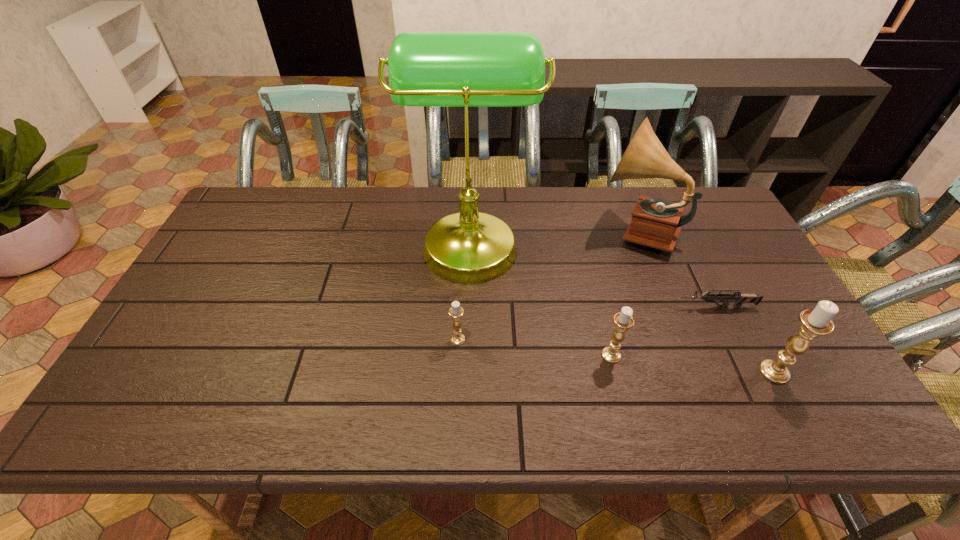
Point out which object is positioned as the third nearest to the tallest candle holder. Please provide its 2D coordinates. Your answer should be formatted as a tuple, i.e. [(x, y)], where the tuple contains the x and y coordinates of a point satisfying the conditions above.

[(656, 223)]

Select which candle holder appears as the closest to the phonograph record. Please provide its 2D coordinates. Your answer should be formatted as a tuple, i.e. [(x, y)], where the tuple contains the x and y coordinates of a point satisfying the conditions above.

[(623, 320)]

Identify the location of the closest candle holder to the rightmost candle holder. This screenshot has width=960, height=540. (623, 320).

The width and height of the screenshot is (960, 540). Find the location of `vacant point that satisfies the following two spatial constraints: 1. on the back side of the third tallest object; 2. on the horn of the fifth shortest object`. vacant point that satisfies the following two spatial constraints: 1. on the back side of the third tallest object; 2. on the horn of the fifth shortest object is located at coordinates (699, 230).

This screenshot has height=540, width=960. In order to click on free location that satisfies the following two spatial constraints: 1. on the desk next to the third shortest object; 2. on the left side of the lamp in this screenshot , I will do click(x=468, y=355).

The width and height of the screenshot is (960, 540). In order to click on vacant space that satisfies the following two spatial constraints: 1. on the desk next to the lamp; 2. on the right side of the second tallest candle holder in this screenshot , I will do `click(468, 355)`.

Where is `vacant point that satisfies the following two spatial constraints: 1. aimed along the barrel of the third farthest object; 2. on the front side of the fourth tallest object`? vacant point that satisfies the following two spatial constraints: 1. aimed along the barrel of the third farthest object; 2. on the front side of the fourth tallest object is located at coordinates (740, 355).

Where is `free point that satisfies the following two spatial constraints: 1. on the back side of the fourth shortest object; 2. on the horn of the phonograph record`? free point that satisfies the following two spatial constraints: 1. on the back side of the fourth shortest object; 2. on the horn of the phonograph record is located at coordinates (699, 230).

Where is `vacant area that satisfies the following two spatial constraints: 1. aimed along the barrel of the fourth nearest object; 2. on the front side of the third object from left to right`? The width and height of the screenshot is (960, 540). vacant area that satisfies the following two spatial constraints: 1. aimed along the barrel of the fourth nearest object; 2. on the front side of the third object from left to right is located at coordinates (740, 355).

Find the location of a particular element. blank space that satisfies the following two spatial constraints: 1. on the desk next to the lamp; 2. on the back side of the second candle holder from left to right is located at coordinates (468, 355).